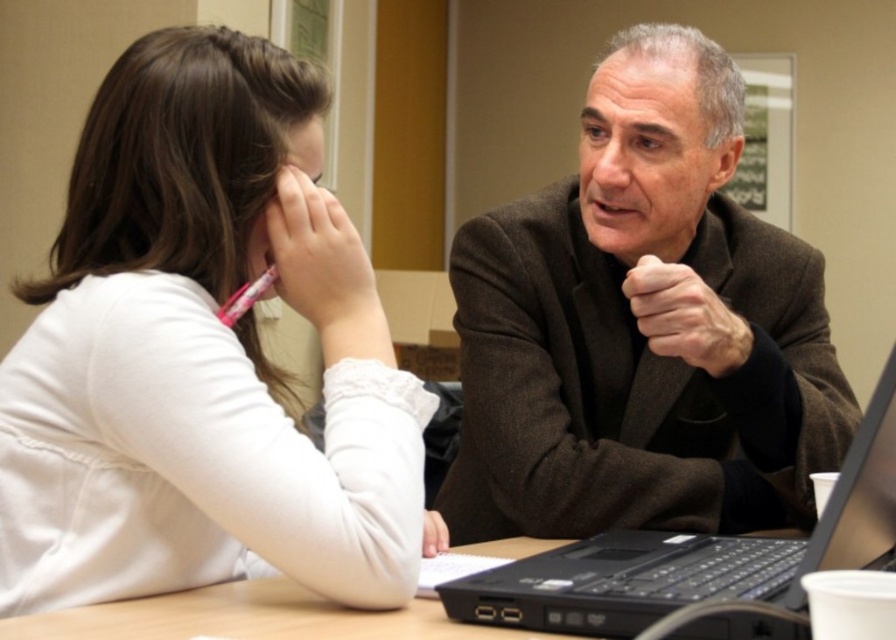
Question: Does brown woolen suit at center have a lesser width compared to black plastic laptop at center?

Choices:
 (A) yes
 (B) no

Answer: (B)

Question: Which point is closer to the camera?

Choices:
 (A) (213, 568)
 (B) (448, 548)
 (C) (300, 592)
 (D) (283, 230)

Answer: (C)

Question: Is white matte shirt at left further to the viewer compared to wooden table at center?

Choices:
 (A) yes
 (B) no

Answer: (A)

Question: Among these points, which one is nearest to the camera?

Choices:
 (A) [x=569, y=627]
 (B) [x=428, y=522]
 (C) [x=696, y=349]
 (D) [x=97, y=528]

Answer: (A)

Question: Where is brown woolen suit at center located in relation to white matte hand at lower center in the image?

Choices:
 (A) right
 (B) left

Answer: (A)

Question: Estimate the real-world distances between objects in this image. Which object is closer to the black plastic laptop at center?

Choices:
 (A) brown woolen suit at center
 (B) pink matte pen at upper left

Answer: (A)